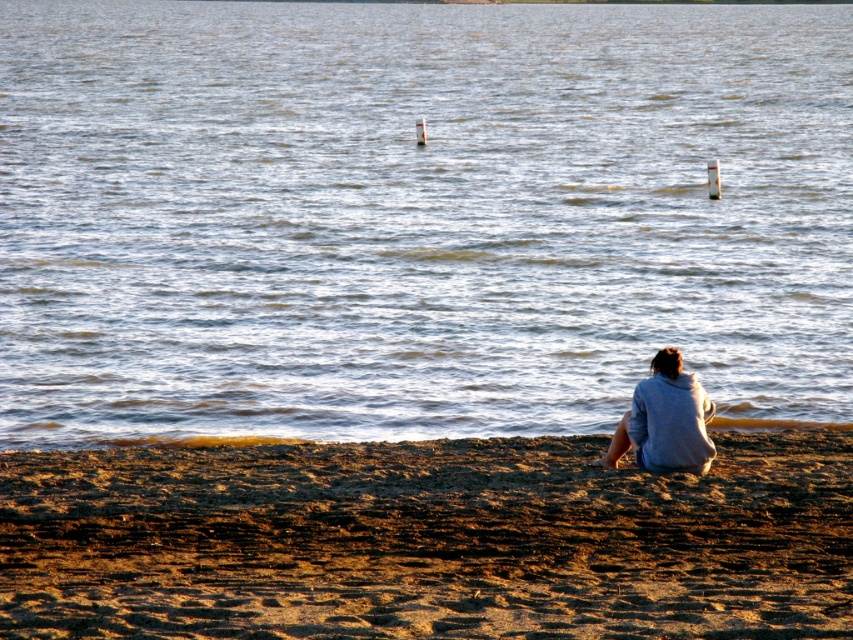
Question: Does clear water at center come in front of brown sandy beach at lower center?

Choices:
 (A) yes
 (B) no

Answer: (B)

Question: Considering the real-world distances, which object is farthest from the brown sandy beach at lower center?

Choices:
 (A) clear water at center
 (B) gray hoodie at lower right

Answer: (A)

Question: Which of these objects is positioned farthest from the clear water at center?

Choices:
 (A) gray hoodie at lower right
 (B) brown sandy beach at lower center

Answer: (B)

Question: Estimate the real-world distances between objects in this image. Which object is farther from the gray hoodie at lower right?

Choices:
 (A) clear water at center
 (B) brown sandy beach at lower center

Answer: (A)

Question: Considering the relative positions of brown sandy beach at lower center and gray hoodie at lower right in the image provided, where is brown sandy beach at lower center located with respect to gray hoodie at lower right?

Choices:
 (A) left
 (B) right

Answer: (A)

Question: Is brown sandy beach at lower center smaller than gray hoodie at lower right?

Choices:
 (A) no
 (B) yes

Answer: (B)